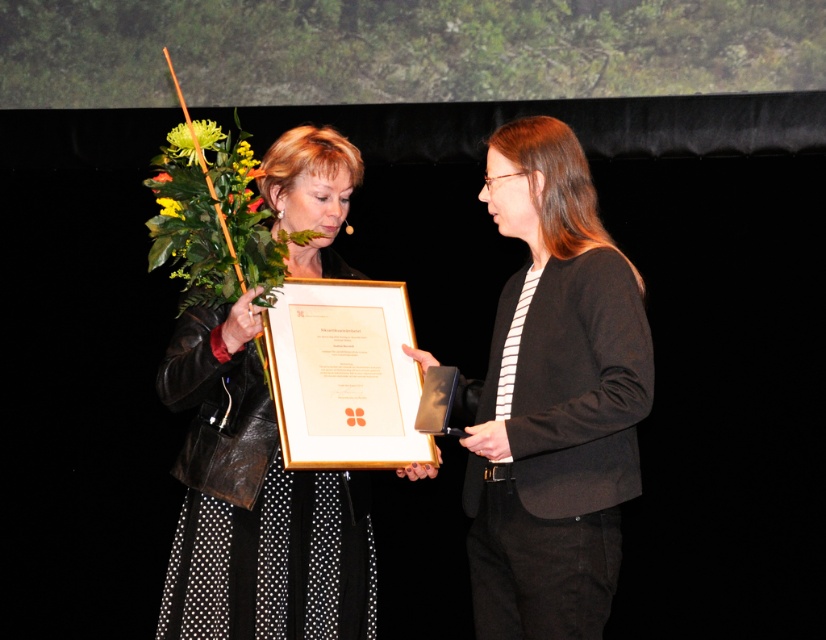
You are a photographer setting up for a stage event. You need to adjust the lighting so that the black matte blazer at center and the green leafy bouquet at upper left are both well lit. Considering their sizes, which object requires a wider light spread to ensure proper illumination?

The black matte blazer at center requires a wider light spread because it is taller than the green leafy bouquet at upper left, so it needs more coverage to be properly illuminated.

You are standing 2 meters away from the stage. The point at coordinates point (546, 161) is part of the stage. Can you reach it without moving closer?

The distance of point (546, 161) from camera is 2.40 meters. Since you are currently 2 meters away from the stage, you are 0.40 meters away from the point. Therefore, you can reach it without moving closer.

You are standing on the stage and need to move from the location of point (x=603, y=512) to point (x=164, y=198). Can you walk directly between them without any obstacles?

Yes, you can walk directly between point (x=603, y=512) and point (x=164, y=198) because point (x=603, y=512) is in front of point (x=164, y=198), indicating there is a clear path between them.